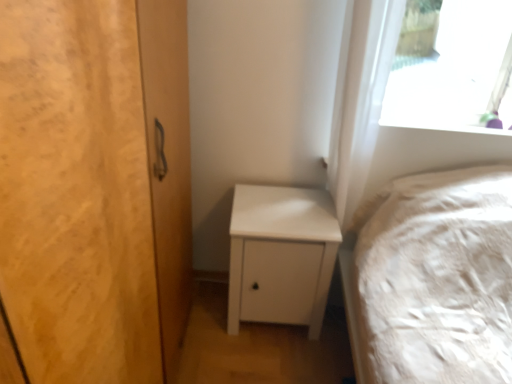
Locate an element on the screen. This screenshot has height=384, width=512. vacant space situated above white matte nightstand at lower center (from a real-world perspective) is located at coordinates (280, 212).